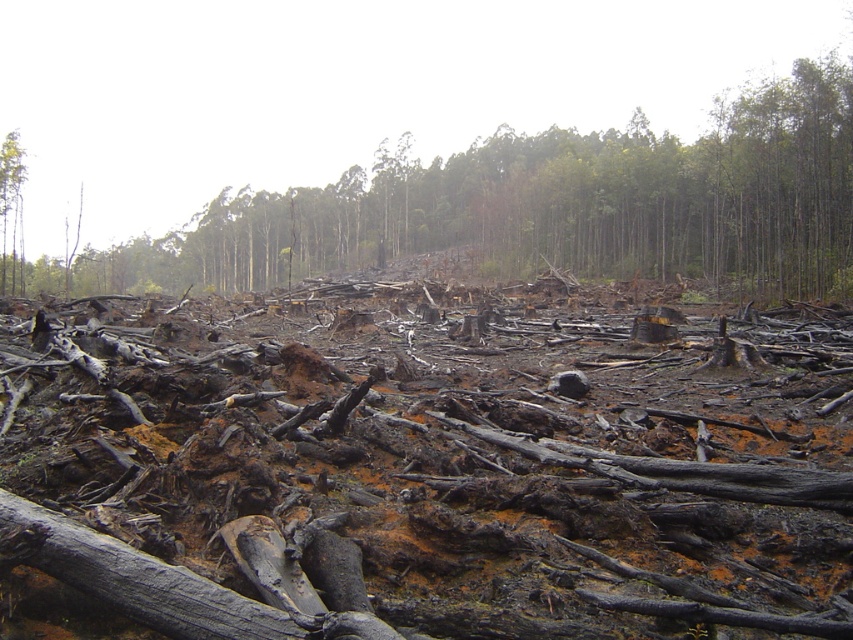
What do you see at coordinates (413, 170) in the screenshot?
I see `charcoal wood debris at center` at bounding box center [413, 170].

This screenshot has height=640, width=853. Find the location of `charcoal wood debris at center`. charcoal wood debris at center is located at coordinates (413, 170).